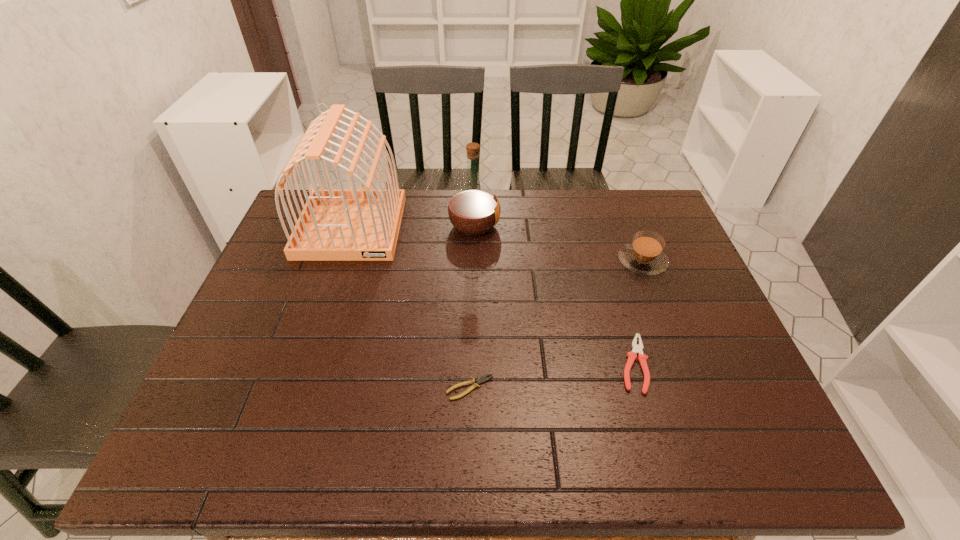
In order to click on free space that satisfies the following two spatial constraints: 1. with an open door on the birdcage; 2. on the right side of the cappuccino in this screenshot , I will do `click(340, 261)`.

Identify the location of vacant space that satisfies the following two spatial constraints: 1. on the back side of the third shortest object; 2. on the front label of the fourth shortest object. (629, 226).

Locate an element on the screen. free spot that satisfies the following two spatial constraints: 1. with an open door on the shortest object; 2. on the left side of the leftmost object is located at coordinates (299, 388).